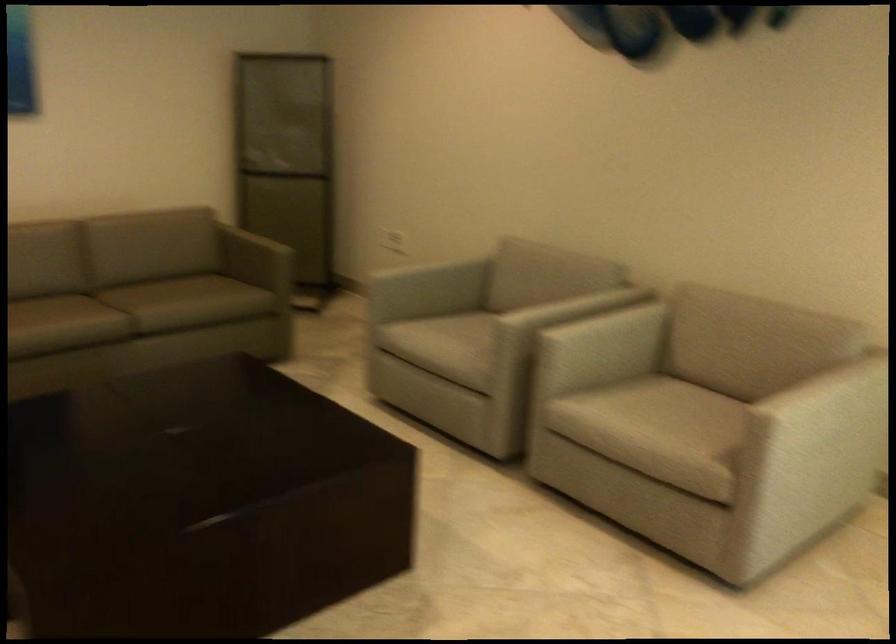
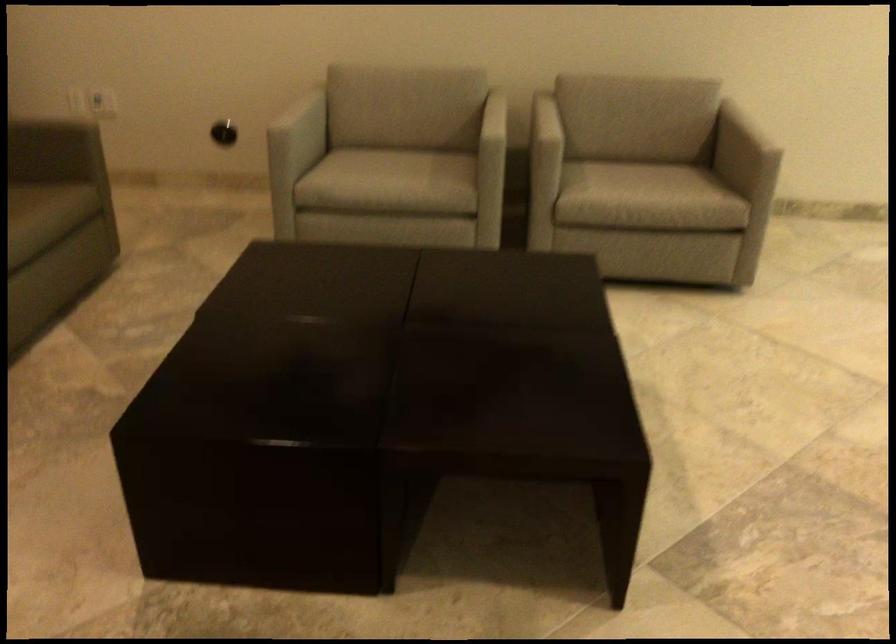
The point at (521, 341) is marked in the first image. Where is the corresponding point in the second image?

(545, 140)